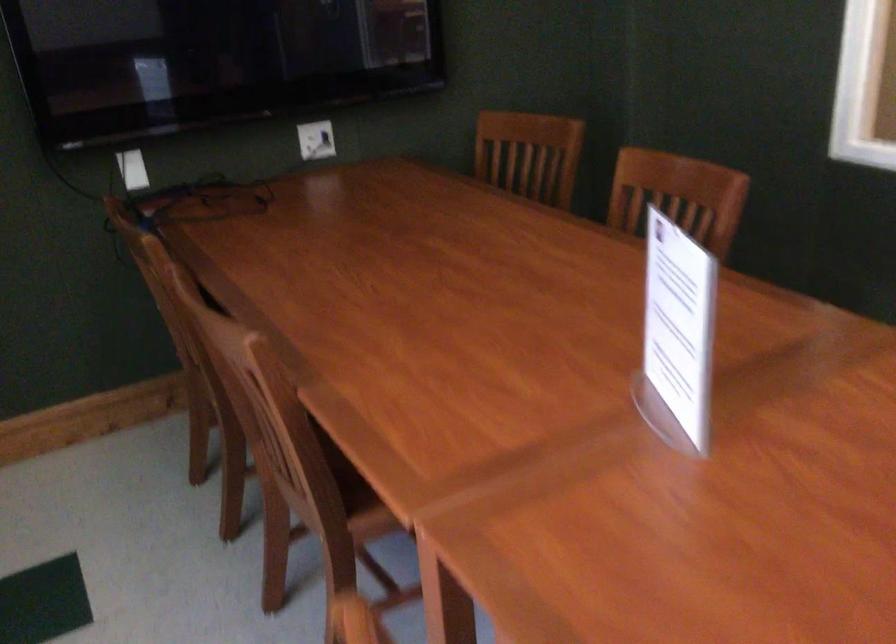
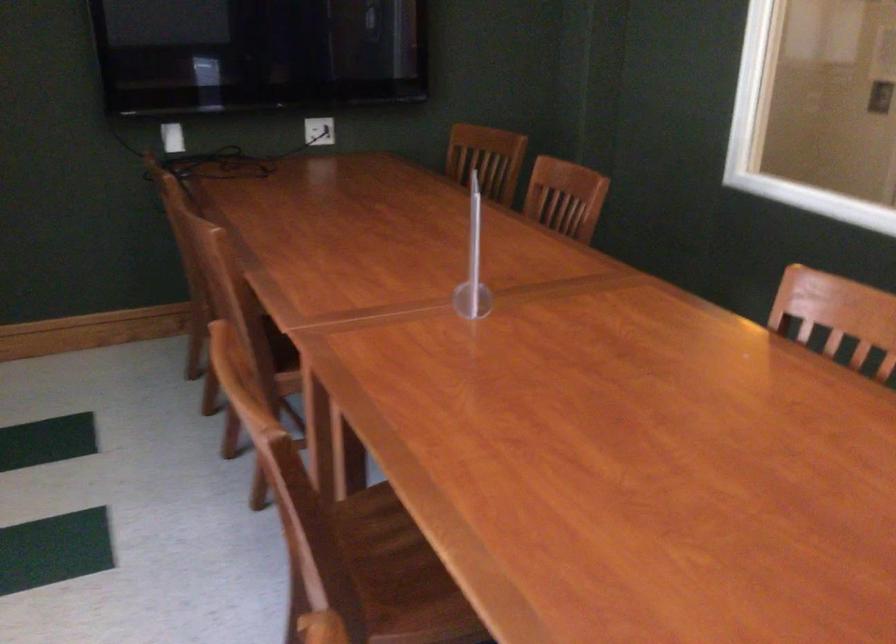
In the second image, find the point that corresponds to point (251, 350) in the first image.

(216, 242)